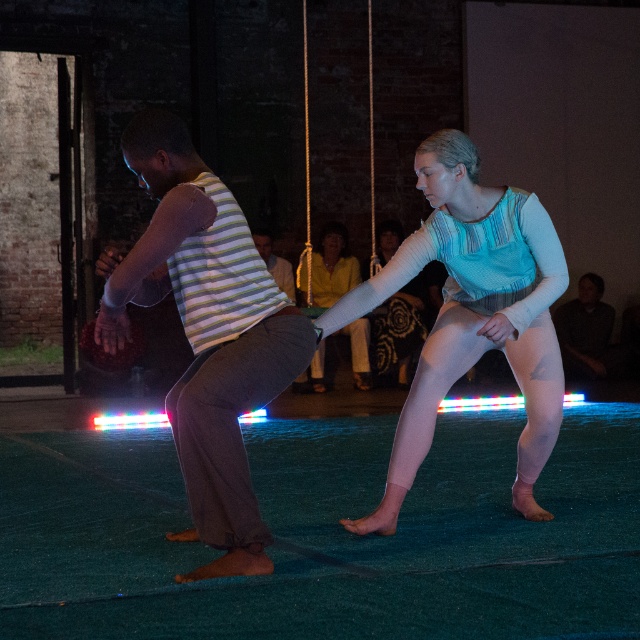
Question: Does matte blue fabric at center have a lesser width compared to dark gray sweater at center?

Choices:
 (A) yes
 (B) no

Answer: (B)

Question: Does dark gray sweater at center have a larger size compared to striped fabric at center?

Choices:
 (A) no
 (B) yes

Answer: (B)

Question: Which of the following is the closest to the observer?

Choices:
 (A) striped cotton tank top at left
 (B) light blue fabric at center
 (C) striped fabric at center
 (D) matte blue fabric at center

Answer: (A)

Question: Can you confirm if matte blue fabric at center is bigger than dark gray sweater at center?

Choices:
 (A) yes
 (B) no

Answer: (A)

Question: Which point appears closest to the camera in this image?

Choices:
 (A) (332, 300)
 (B) (390, 280)
 (C) (604, 365)

Answer: (B)

Question: Considering the real-world distances, which object is farthest from the light blue fabric at center?

Choices:
 (A) dark gray sweater at center
 (B) striped cotton tank top at left
 (C) matte blue fabric at center

Answer: (B)